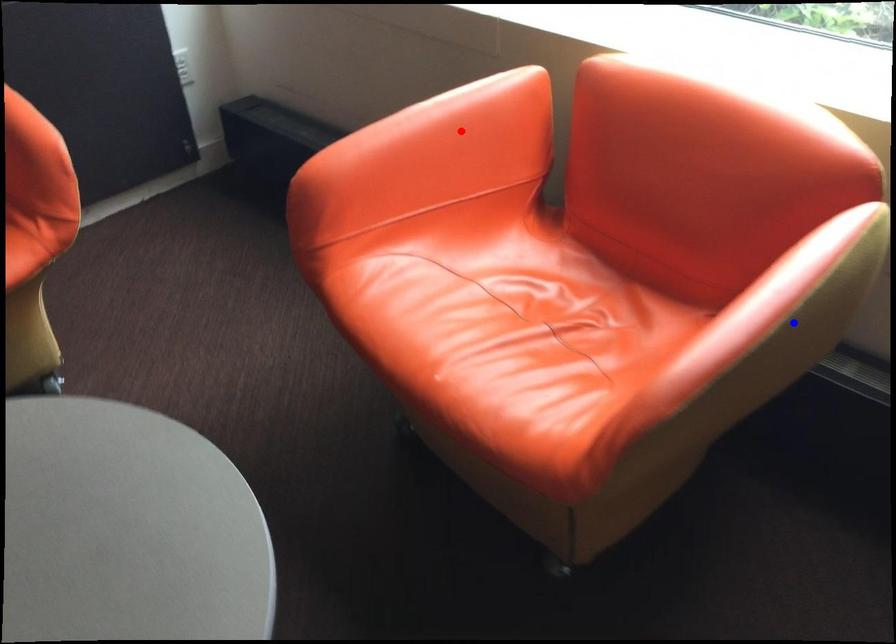
Question: In the image, two points are highlighted. Which point is nearer to the camera? Reply with the corresponding letter.

Choices:
 (A) blue point
 (B) red point

Answer: (A)